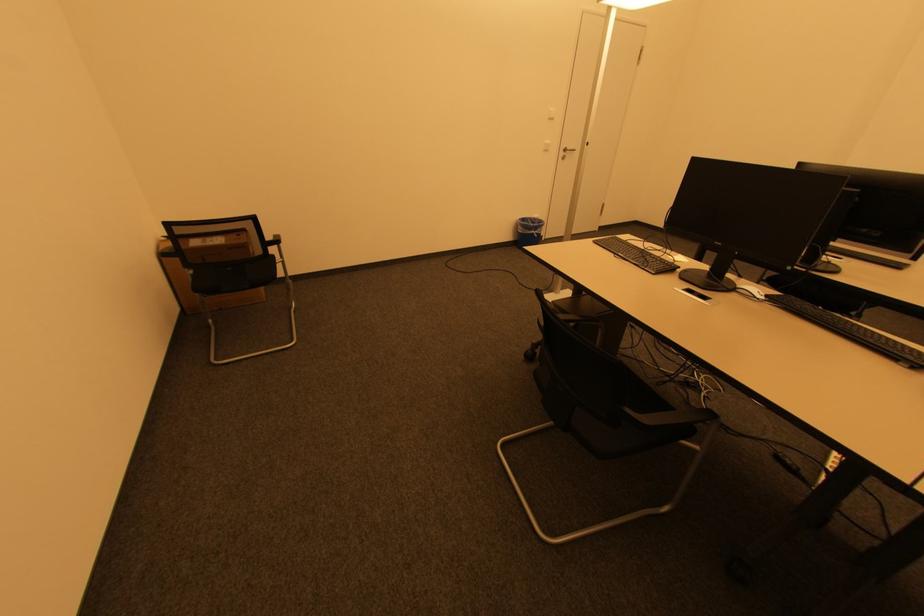
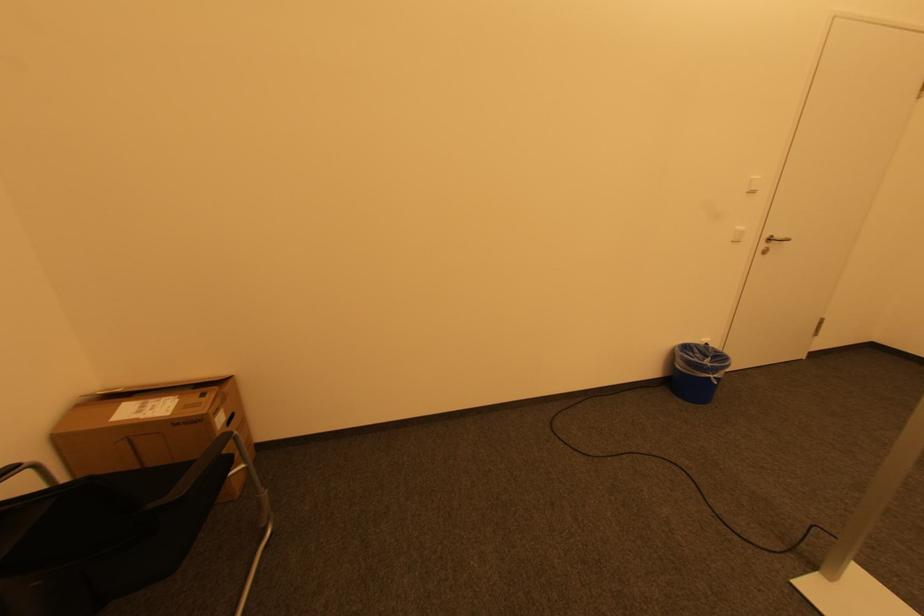
Question: What movement of the cameraman would produce the second image?

Choices:
 (A) Left
 (B) Right
 (C) Forward
 (D) Backward

Answer: (C)